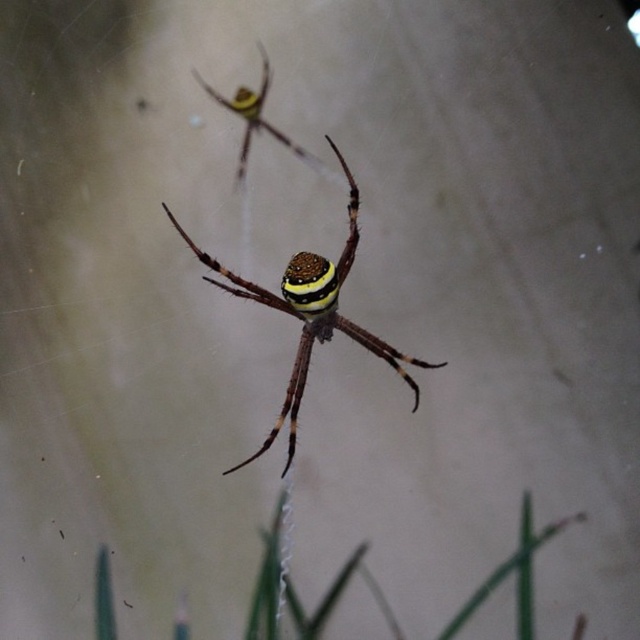
You are a photographer aiming to capture a clear shot of the yellow striped spider at upper center. However, the green grass at bottom is blocking your view. Can you adjust your camera angle to focus on the spider without the grass obstructing the shot?

The green grass at bottom is in front of the yellow striped spider at upper center, so adjusting the camera angle slightly upward might allow you to focus on the spider while moving the grass out of the frame.

You are a small insect trying to reach the yellow striped spider at upper center from the green grass at bottom. Given that you can jump 2 meters high, will you be able to reach the spider?

The distance between the green grass at bottom and the yellow striped spider at upper center is 2.27 meters. Since your jump can only reach 2 meters, you cannot reach the spider.

You are a photographer who wants to capture a closeup of the yellow striped spider at center without the green grass at bottom being visible in the shot. Based on their positions, is this possible?

The green grass at bottom is positioned on the right side of yellow striped spider at center, so if you frame the shot to exclude the right side of the yellow striped spider at center, the green grass at bottom won